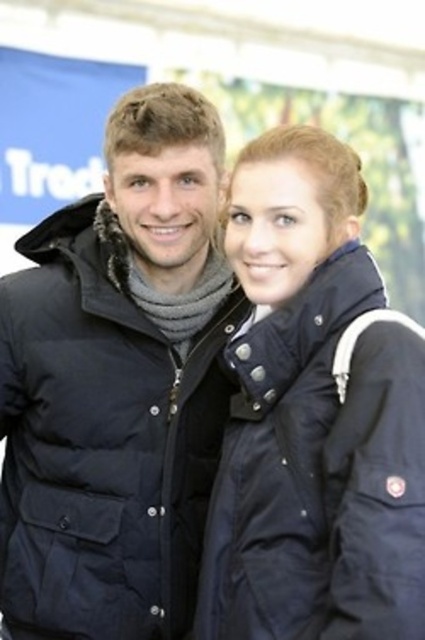
You are a photographer trying to capture both the matte black jacket at center and the navy blue down jacket at center in a single frame. Since the camera can only focus on one jacket at a time, which jacket should you focus on to ensure the other is still in the frame?

The matte black jacket at center is to the left of the navy blue down jacket at center, so focusing on the navy blue down jacket at center will keep the matte black jacket at center within the frame as it is positioned to the left.

You are standing at the point with coordinates point (422, 536) and want to move towards the point with coordinates point (127, 557). Which direction should you move relative to your current position?

You should move downward and to the right relative to your current position at point (422, 536) because point (127, 557) is located behind it.